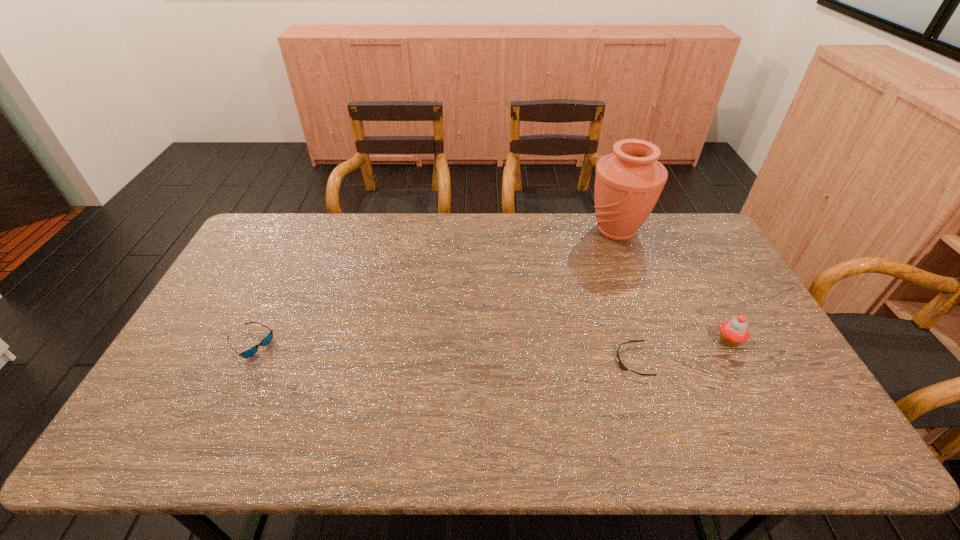
What are the coordinates of `the farthest object` in the screenshot? It's located at (628, 183).

In order to click on the tallest object in this screenshot , I will do `click(628, 183)`.

At what (x,y) coordinates should I click in order to perform the action: click on cupcake. Please return your answer as a coordinate pair (x, y). The height and width of the screenshot is (540, 960). Looking at the image, I should click on (734, 332).

At what (x,y) coordinates should I click in order to perform the action: click on the second tallest object. Please return your answer as a coordinate pair (x, y). Image resolution: width=960 pixels, height=540 pixels. Looking at the image, I should click on (734, 332).

Image resolution: width=960 pixels, height=540 pixels. I want to click on the second shortest object, so (x=250, y=352).

In order to click on the taller sunglasses in this screenshot , I will do `click(250, 352)`.

The height and width of the screenshot is (540, 960). What are the coordinates of `the shortest object` in the screenshot? It's located at (620, 363).

Find the location of a particular element. the right sunglasses is located at coordinates point(620,363).

Where is `free space located on the left of the vase`? free space located on the left of the vase is located at coordinates (546, 231).

This screenshot has height=540, width=960. I want to click on vacant region located on the back of the third shortest object, so click(x=691, y=268).